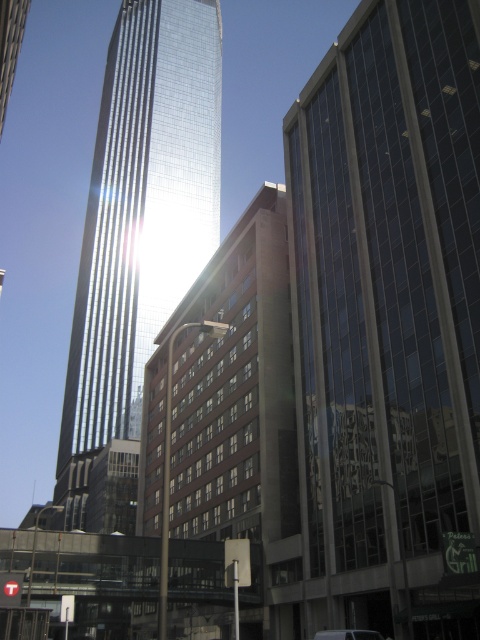
Question: Which object appears closest to the camera in this image?

Choices:
 (A) glassy reflective skyscraper at center
 (B) shiny glass skyscraper at center

Answer: (A)

Question: Does glassy reflective skyscraper at center have a smaller size compared to metallic silver van at center?

Choices:
 (A) yes
 (B) no

Answer: (B)

Question: Which object is the closest to the shiny glass skyscraper at center?

Choices:
 (A) glassy reflective skyscraper at center
 (B) metallic silver van at center

Answer: (A)

Question: Is glassy reflective skyscraper at center behind metallic silver van at center?

Choices:
 (A) yes
 (B) no

Answer: (B)

Question: Can you confirm if glassy reflective skyscraper at center is positioned below metallic silver van at center?

Choices:
 (A) yes
 (B) no

Answer: (B)

Question: Which object is closer to the camera taking this photo?

Choices:
 (A) metallic silver van at center
 (B) shiny glass skyscraper at center
 (C) glassy reflective skyscraper at center

Answer: (C)